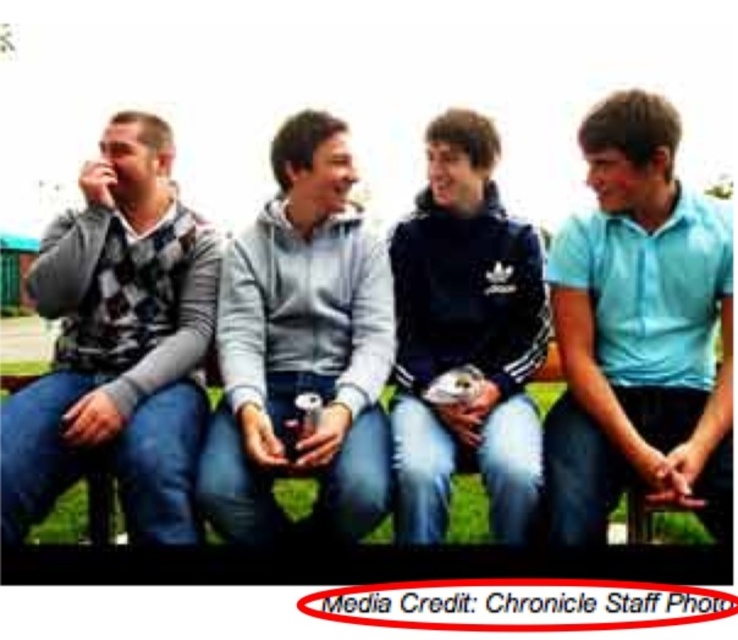
Question: Can you confirm if matte gray sweater at left is positioned below black matte jacket at center?

Choices:
 (A) yes
 (B) no

Answer: (A)

Question: Among these points, which one is nearest to the camera?

Choices:
 (A) (15, 426)
 (B) (424, 426)
 (C) (393, 308)

Answer: (A)

Question: Estimate the real-world distances between objects in this image. Which object is closer to the black matte jacket at center?

Choices:
 (A) light blue polo shirt at center
 (B) matte gray sweater at left
 (C) gray fleece hoodie at center

Answer: (C)

Question: Is light blue polo shirt at center further to camera compared to matte gray sweater at left?

Choices:
 (A) yes
 (B) no

Answer: (A)

Question: Which object is closer to the camera taking this photo?

Choices:
 (A) matte gray sweater at left
 (B) black matte jacket at center
 (C) light blue polo shirt at center

Answer: (A)

Question: Does gray fleece hoodie at center come behind black matte jacket at center?

Choices:
 (A) yes
 (B) no

Answer: (A)